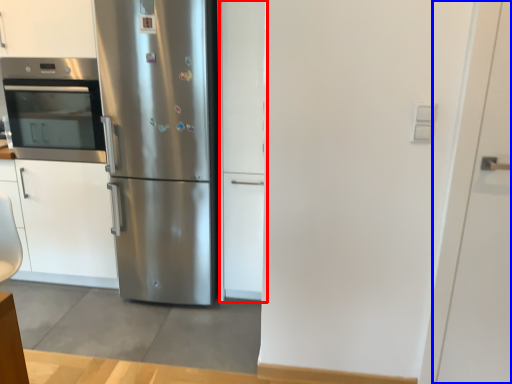
Question: Which point is further to the camera, door (highlighted by a red box) or door (highlighted by a blue box)?

Choices:
 (A) door
 (B) door

Answer: (A)